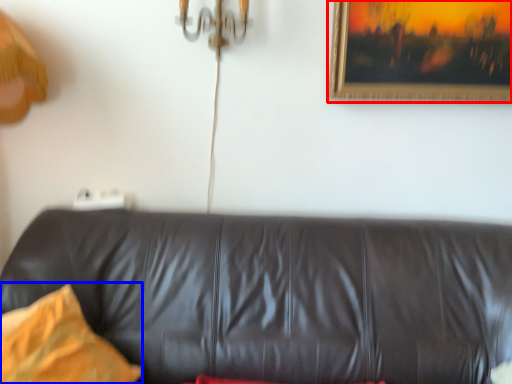
Question: Among these objects, which one is nearest to the camera, picture frame (highlighted by a red box) or pillow (highlighted by a blue box)?

Choices:
 (A) picture frame
 (B) pillow

Answer: (B)